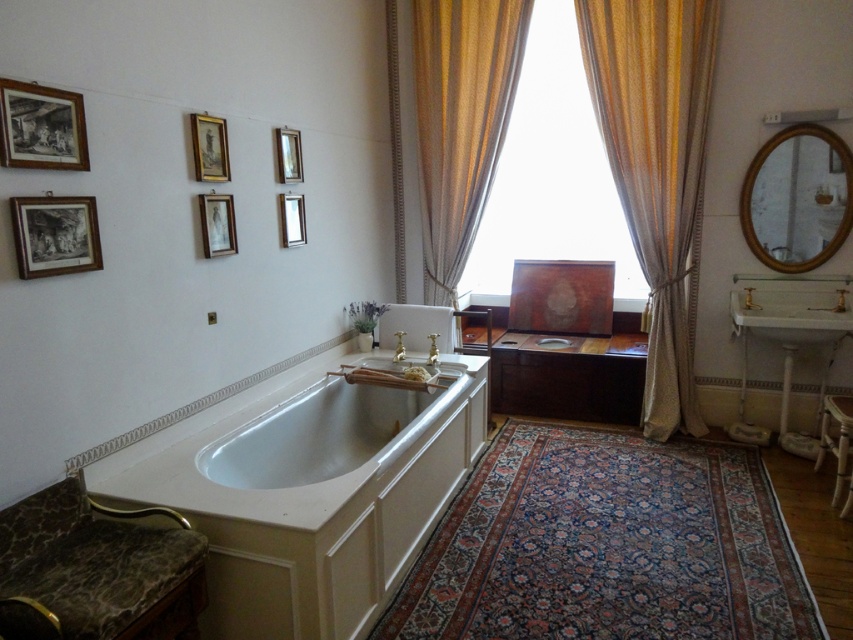
Question: Considering the real-world distances, which object is farthest from the metallic rectangular frame at upper center?

Choices:
 (A) white glossy bathtub at center
 (B) translucent fabric at center
 (C) silky beige curtain at center

Answer: (B)

Question: Can you confirm if silky beige curtain at center is positioned to the right of white glossy bathtub at center?

Choices:
 (A) yes
 (B) no

Answer: (A)

Question: Does gold textured curtain at center have a smaller size compared to metallic rectangular frame at upper center?

Choices:
 (A) yes
 (B) no

Answer: (B)

Question: Which object is closer to the camera taking this photo?

Choices:
 (A) silky beige curtains at center
 (B) gold-framed picture at upper center
 (C) black paper picture frame at upper left

Answer: (C)

Question: Among these points, which one is farthest from the camera?

Choices:
 (A) (299, 212)
 (B) (28, 214)

Answer: (A)

Question: Does matte black picture frame at upper left appear on the right side of metallic rectangular frame at upper center?

Choices:
 (A) yes
 (B) no

Answer: (B)